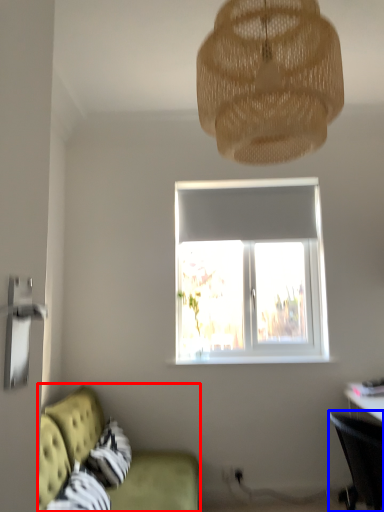
Question: Among these objects, which one is nearest to the camera, studio couch (highlighted by a red box) or chair (highlighted by a blue box)?

Choices:
 (A) studio couch
 (B) chair

Answer: (A)